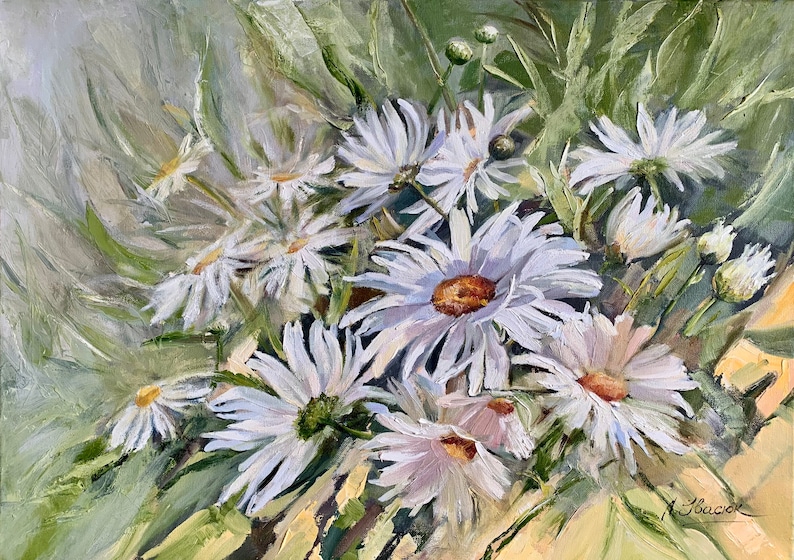
Find the location of `artwork`. artwork is located at coordinates (406, 305).